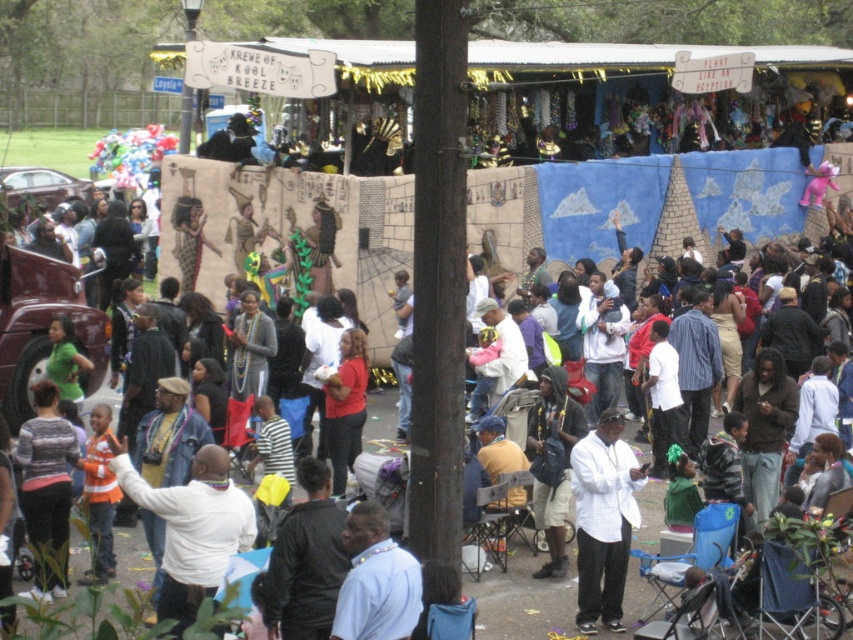
You are a photographer standing at the edge of the crowd. You want to capture a photo of the white matte shirt at center. Where should you aim your camera to ensure the shirt is centered in the photo?

To center the white matte shirt at center in the photo, aim your camera at the 2D location point specified at coordinates (602, 520).